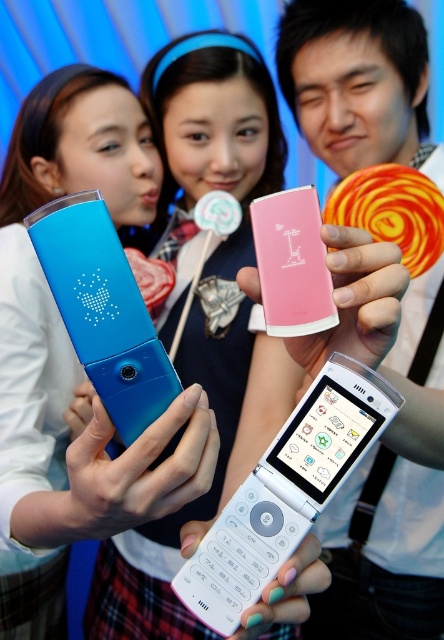
You are standing at the origin point in the image. Which of the two points, point (174, 49) or point (117, 264), is farther away from you?

Point (174, 49) is farther away from you because it is behind point (117, 264).

You are standing in front of the image and want to know the exact location of the white plastic flip phone at center. What are its coordinates?

The white plastic flip phone at center is located at coordinates point (285, 492).